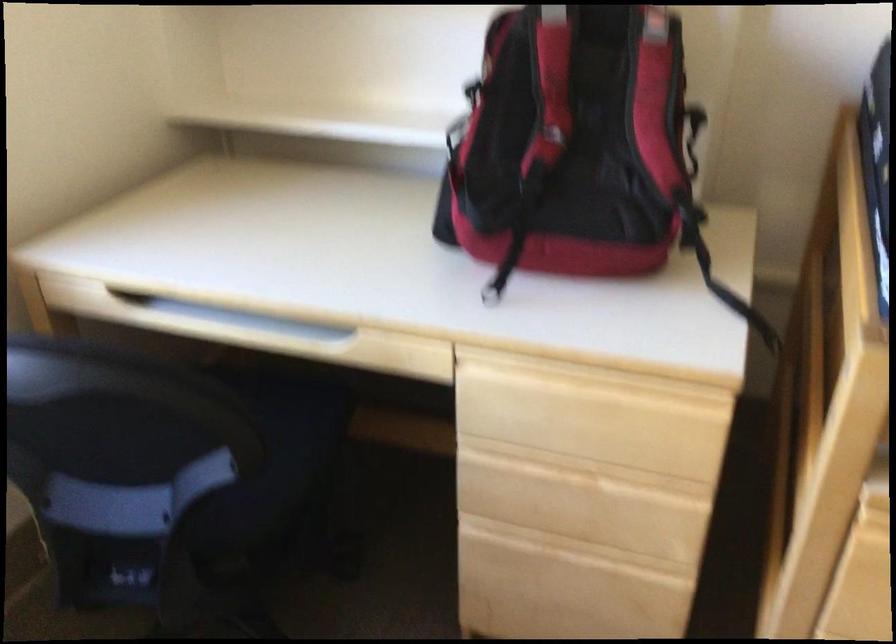
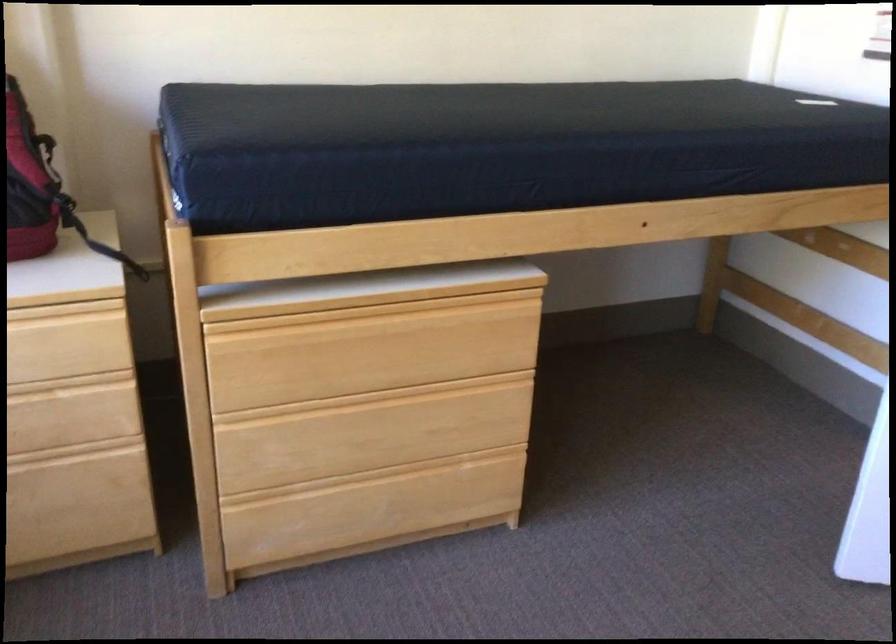
Where in the second image is the point corresponding to point (724, 268) from the first image?

(101, 245)